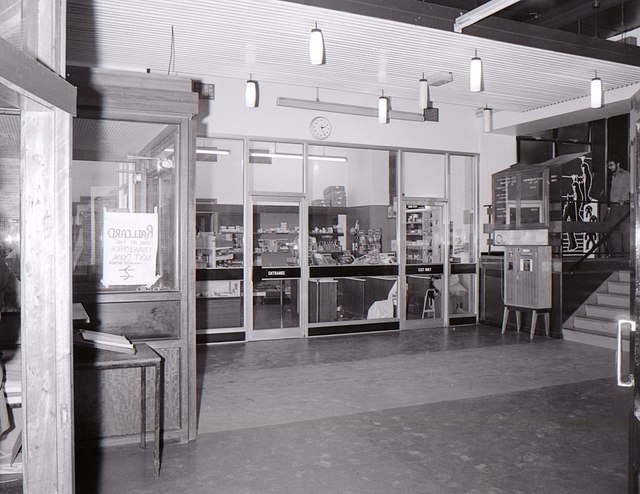
I want to click on door handle, so click(620, 334).